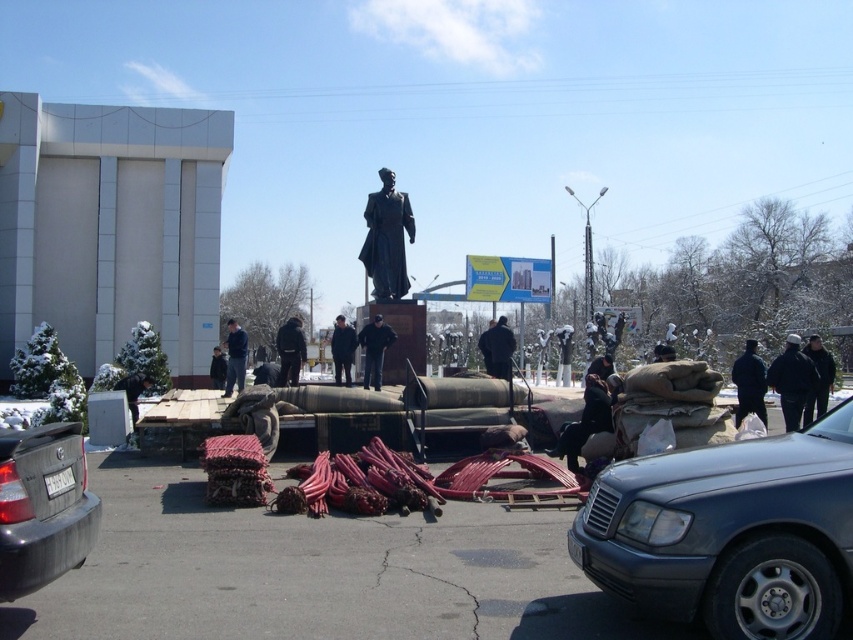
You are a delivery person who needs to park your 5.5 meter long truck between the metallic blue sedan at center and the black matte jacket at lower right. Is there enough space for your truck to fit between them?

The metallic blue sedan at center is 7.19 meters away from the black matte jacket at lower right. Since your truck is 5.5 meters long, there is sufficient space between the metallic blue sedan at center and the black matte jacket at lower right to accommodate it.

You are standing in the plaza and see a point marked at coordinates (791, 380). Which object is this point located on?

The point at coordinates (791, 380) is located on the black fabric jacket at lower right.

You are a pedestrian standing at the edge of the square and want to reach the black matte jacket at lower right without walking through the statue area. Is the metallic blue sedan at center blocking your path?

The metallic blue sedan at center is positioned on the left side of black matte jacket at lower right, so it is blocking the direct path to the jacket. You would need to go around the sedan to reach the jacket without entering the statue area.